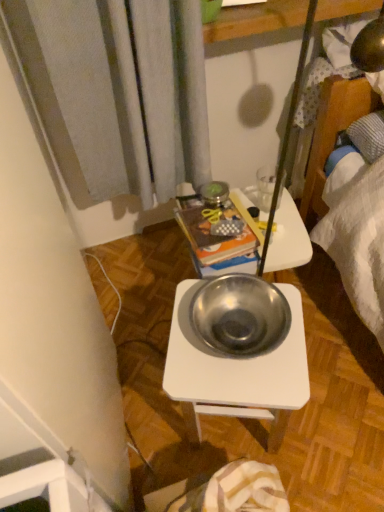
Question: Does metallic silver bowl at center appear on the right side of metallic books at center?

Choices:
 (A) no
 (B) yes

Answer: (B)

Question: Does metallic silver bowl at center have a greater height compared to metallic books at center?

Choices:
 (A) no
 (B) yes

Answer: (A)

Question: Is there a large distance between metallic silver bowl at center and metallic books at center?

Choices:
 (A) no
 (B) yes

Answer: (A)

Question: Does metallic silver bowl at center turn towards metallic books at center?

Choices:
 (A) no
 (B) yes

Answer: (A)

Question: From a real-world perspective, is metallic silver bowl at center on metallic books at center?

Choices:
 (A) no
 (B) yes

Answer: (B)

Question: Is metallic books at center located within metallic silver bowl at center?

Choices:
 (A) no
 (B) yes

Answer: (A)

Question: Can you confirm if transparent glass at upper center is wider than metallic books at center?

Choices:
 (A) yes
 (B) no

Answer: (B)

Question: Can you confirm if transparent glass at upper center is thinner than metallic books at center?

Choices:
 (A) yes
 (B) no

Answer: (A)

Question: Does transparent glass at upper center have a lesser height compared to metallic books at center?

Choices:
 (A) yes
 (B) no

Answer: (A)

Question: Considering the relative positions of transparent glass at upper center and metallic books at center in the image provided, is transparent glass at upper center behind metallic books at center?

Choices:
 (A) no
 (B) yes

Answer: (B)

Question: Is transparent glass at upper center placed right next to metallic books at center?

Choices:
 (A) no
 (B) yes

Answer: (A)

Question: Considering the relative sizes of transparent glass at upper center and metallic books at center in the image provided, is transparent glass at upper center taller than metallic books at center?

Choices:
 (A) yes
 (B) no

Answer: (B)

Question: Does metallic books at center turn towards metallic white desk at center?

Choices:
 (A) no
 (B) yes

Answer: (B)